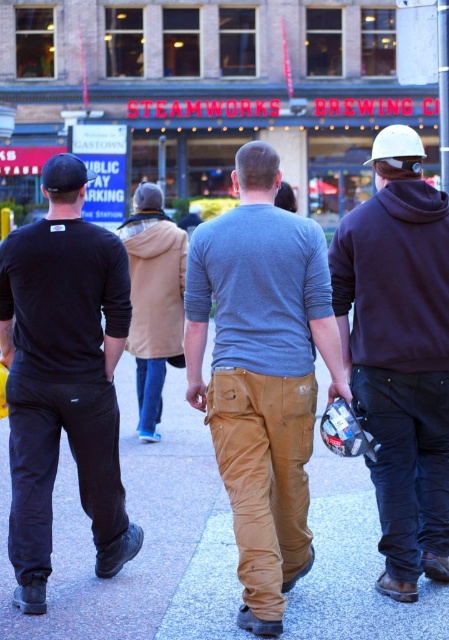
You are standing at the origin of a coordinate system placed at the bottom left corner of the image. You see a point labeled at coordinates point (64,385). Which object from the scene is located at this point?

The point (64,385) corresponds to the black matte pants at left.

You are standing in front of the image and want to determine which of the two points, point (106, 266) or point (49, 180), is closer to you. Based on the scene description, which point is closer?

Point (106, 266) is closer to you than point (49, 180) because it is further to the camera according to the description.

You are a pedestrian standing on the sidewalk and want to walk to the store across the street. You see the smooth concrete pavement at center and the khaki pants at center. Which one is closer to you?

The smooth concrete pavement at center is closer to you because it is not as tall as the khaki pants at center, indicating it is nearer in the visual plane.